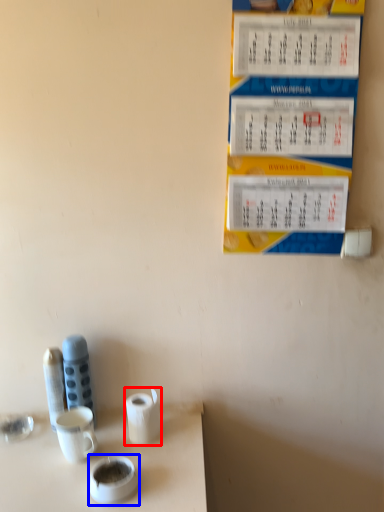
Question: Which point is further to the camera, toilet paper (highlighted by a red box) or teacup (highlighted by a blue box)?

Choices:
 (A) toilet paper
 (B) teacup

Answer: (A)